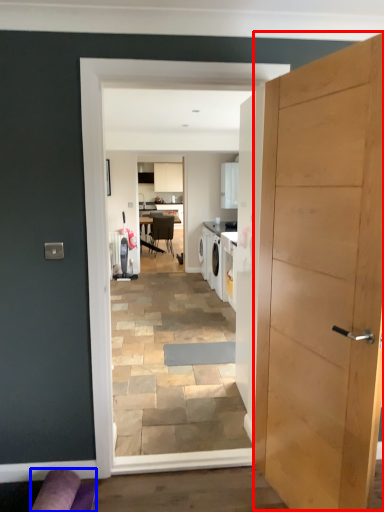
Question: Which point is further to the camera, door (highlighted by a red box) or couch (highlighted by a blue box)?

Choices:
 (A) door
 (B) couch

Answer: (B)